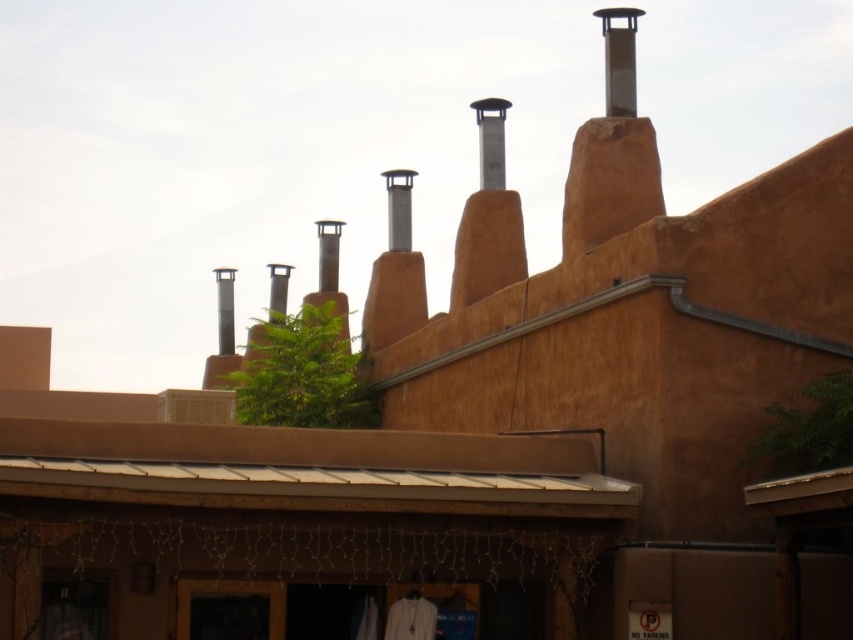
At what (x,y) coordinates should I click in order to perform the action: click on smooth silver chimney at upper right. Please return your answer as a coordinate pair (x, y). Looking at the image, I should click on click(x=619, y=60).

Does smooth silver chimney at upper right have a lesser height compared to satin silver chimney at upper center?

No.

The image size is (853, 640). I want to click on smooth silver chimney at upper right, so click(619, 60).

The image size is (853, 640). Identify the location of smooth silver chimney at upper right. (619, 60).